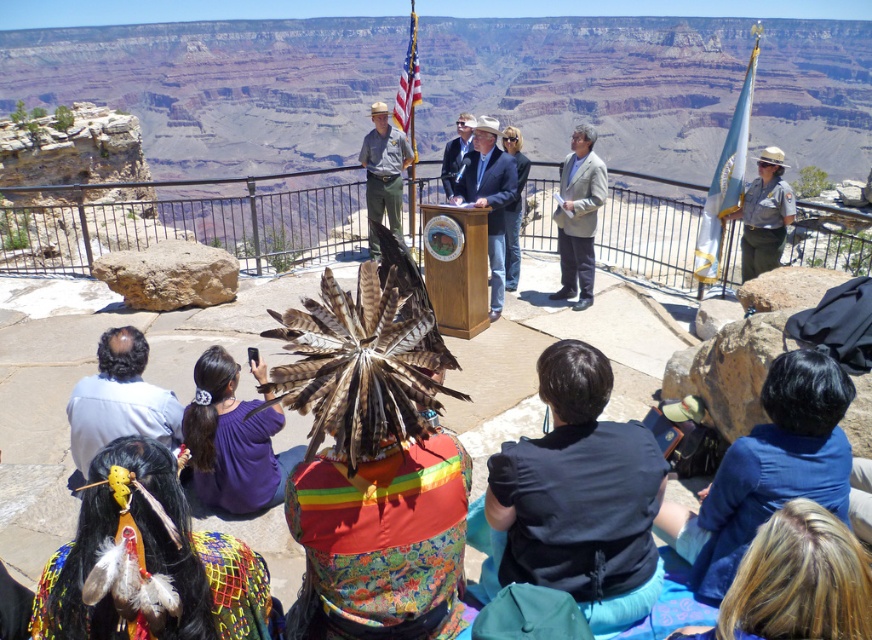
Consider the image. You are a photographer at the viewpoint overlooking the Grand Canyon. You notice the purple fabric at center and the light blue suit at center. Which object would you focus on if you want to capture the larger subject in your photo?

The light blue suit at center is larger than the purple fabric at center, so focusing on the light blue suit at center would capture the larger subject.

You are standing at the viewpoint overlooking the Grand Canyon. You see a group of people sitting on the ground facing a speaker at a podium. There is also a point marked at coordinates (230,440). What color is the object located at that point?

The object at point (230,440) is purple fabric at center.